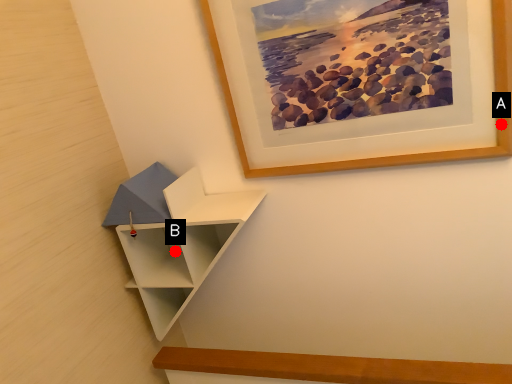
Question: Two points are circled on the image, labeled by A and B beside each circle. Among these points, which one is farthest from the camera?

Choices:
 (A) A is further
 (B) B is further

Answer: (B)